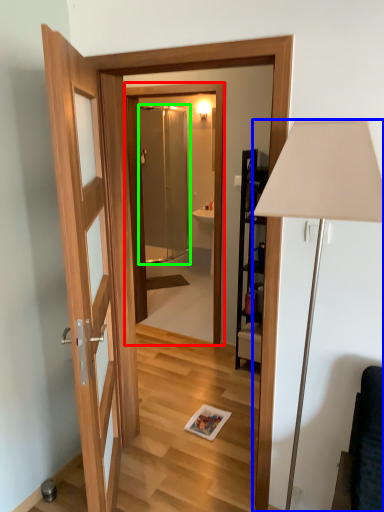
Question: Based on their relative distances, which object is farther from mirror (highlighted by a red box)? Choose from lamp (highlighted by a blue box) and screen door (highlighted by a green box).

Choices:
 (A) lamp
 (B) screen door

Answer: (A)